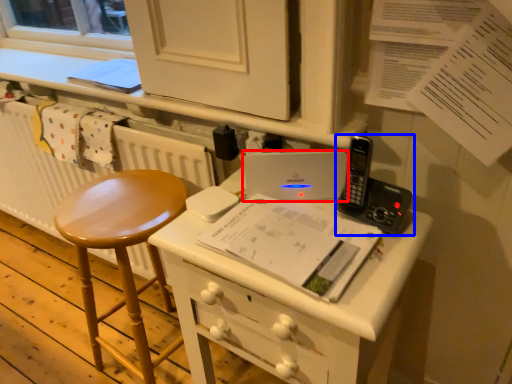
Question: Among these objects, which one is farthest to the camera, laptop (highlighted by a red box) or equipment (highlighted by a blue box)?

Choices:
 (A) laptop
 (B) equipment

Answer: (A)